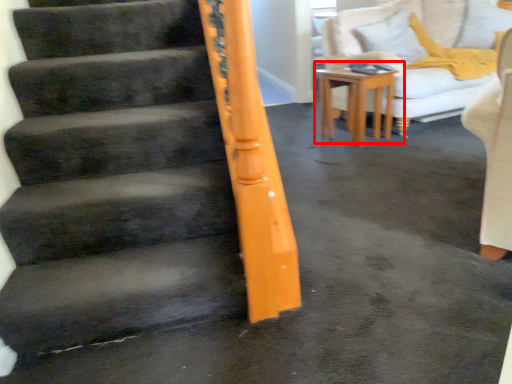
Question: From the image's perspective, what is the correct spatial positioning of table (annotated by the red box) in reference to pillow?

Choices:
 (A) below
 (B) above

Answer: (A)